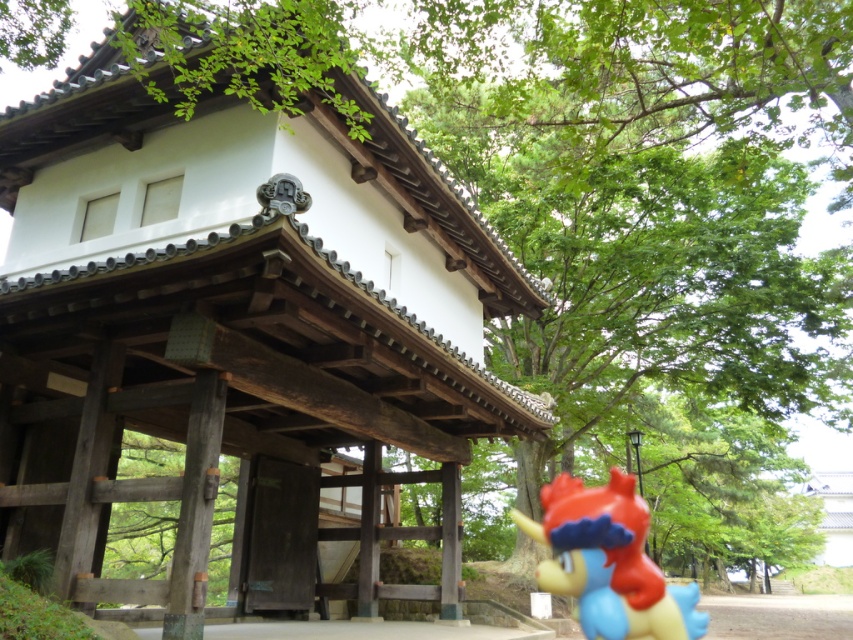
Question: Which point is closer to the camera?

Choices:
 (A) matte plastic toy at center
 (B) wooden gate at center

Answer: (B)

Question: Among these objects, which one is nearest to the camera?

Choices:
 (A) wooden gate at center
 (B) matte plastic toy at center

Answer: (A)

Question: Can you confirm if wooden gate at center is wider than matte plastic toy at center?

Choices:
 (A) no
 (B) yes

Answer: (B)

Question: Which point is closer to the camera?

Choices:
 (A) (660, 618)
 (B) (83, 220)

Answer: (A)

Question: Is wooden gate at center positioned behind matte plastic toy at center?

Choices:
 (A) yes
 (B) no

Answer: (B)

Question: Observing the image, what is the correct spatial positioning of wooden gate at center in reference to matte plastic toy at center?

Choices:
 (A) left
 (B) right

Answer: (A)